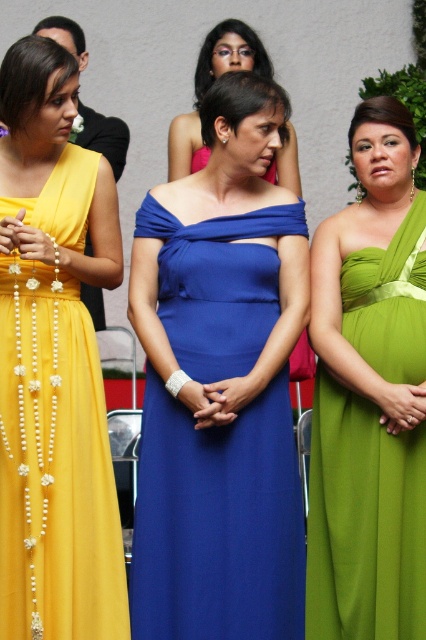
Question: Does green satin dress at right appear on the right side of blue satin dress at center?

Choices:
 (A) no
 (B) yes

Answer: (B)

Question: Which is farther from the yellow satin dress at left?

Choices:
 (A) matte blue dress at center
 (B) green satin dress at right

Answer: (B)

Question: Among these objects, which one is nearest to the camera?

Choices:
 (A) blue satin dress at center
 (B) matte blue dress at center
 (C) yellow satin dress at left
 (D) green satin dress at right

Answer: (C)

Question: Is matte blue dress at center to the left of yellow satin dress at left from the viewer's perspective?

Choices:
 (A) no
 (B) yes

Answer: (A)

Question: Can you confirm if yellow satin dress at left is positioned above green satin dress at right?

Choices:
 (A) yes
 (B) no

Answer: (A)

Question: Which object appears closest to the camera in this image?

Choices:
 (A) blue satin dress at center
 (B) yellow satin dress at left
 (C) green satin dress at right
 (D) matte blue dress at center

Answer: (B)